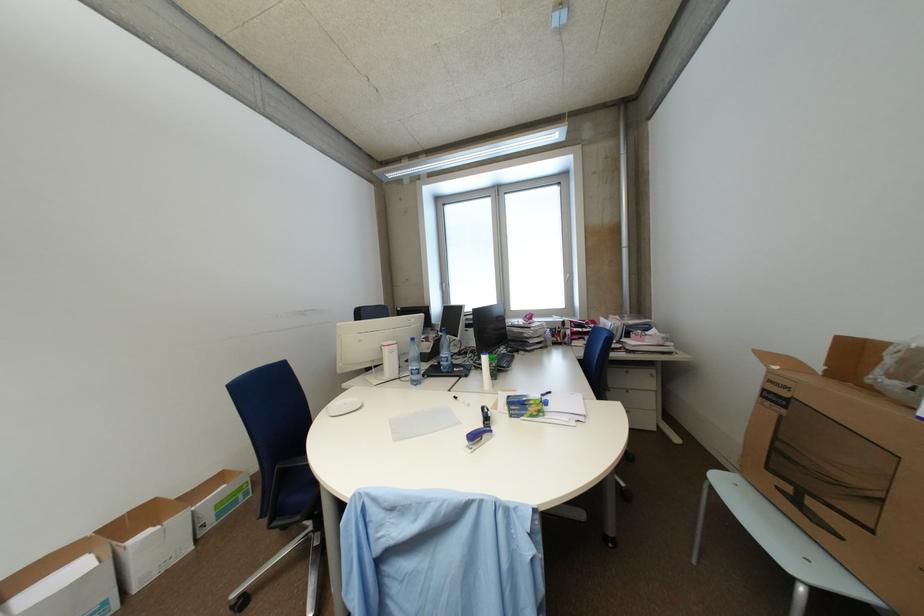
Where is `white tape dispenser`? The height and width of the screenshot is (616, 924). white tape dispenser is located at coordinates (390, 360).